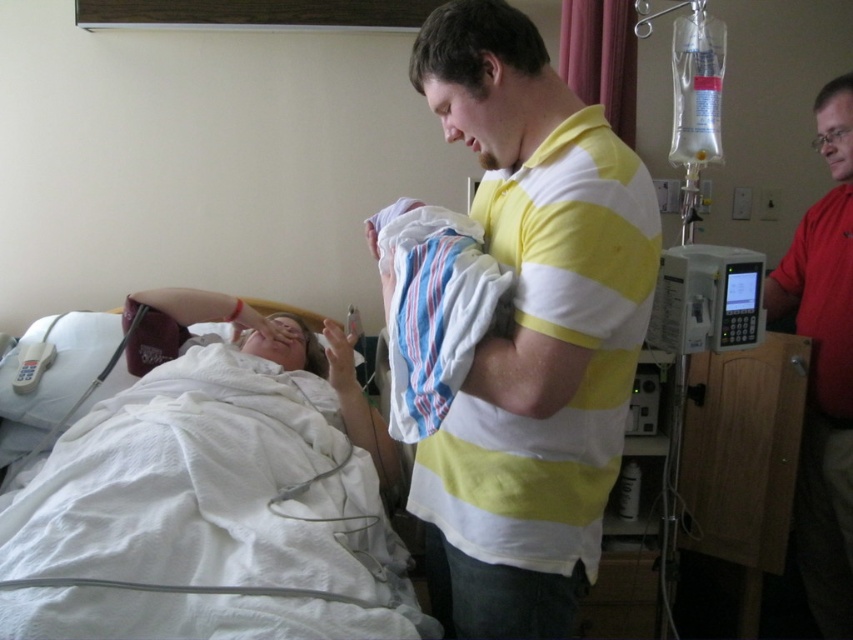
The image size is (853, 640). Describe the element at coordinates (532, 332) in the screenshot. I see `yellow striped shirt at center` at that location.

Which of these two, yellow striped shirt at center or red shirt at right, stands shorter?

yellow striped shirt at center

At what (x,y) coordinates should I click in order to perform the action: click on yellow striped shirt at center. Please return your answer as a coordinate pair (x, y). This screenshot has width=853, height=640. Looking at the image, I should click on (532, 332).

At what (x,y) coordinates should I click in order to perform the action: click on yellow striped shirt at center. Please return your answer as a coordinate pair (x, y). The image size is (853, 640). Looking at the image, I should click on (532, 332).

Between red shirt at right and striped cotton blanket at center, which one has more height?

With more height is red shirt at right.

Does point (831, 164) come in front of point (416, 259)?

No.

Locate an element on the screen. red shirt at right is located at coordinates (824, 368).

The image size is (853, 640). In order to click on red shirt at right in this screenshot , I will do [x=824, y=368].

Who is more forward, [627,172] or [321,422]?

Point [627,172] is more forward.

Find the location of a particular element. yellow striped shirt at center is located at coordinates (532, 332).

This screenshot has height=640, width=853. In order to click on yellow striped shirt at center in this screenshot , I will do `click(532, 332)`.